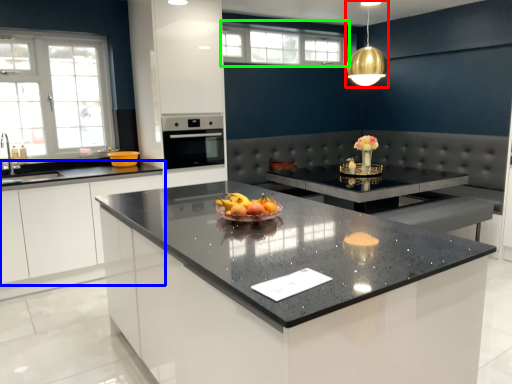
Question: Which object is positioned closest to light fixture (highlighted by a red box)? Select from cabinetry (highlighted by a blue box) and window (highlighted by a green box).

Choices:
 (A) cabinetry
 (B) window

Answer: (B)